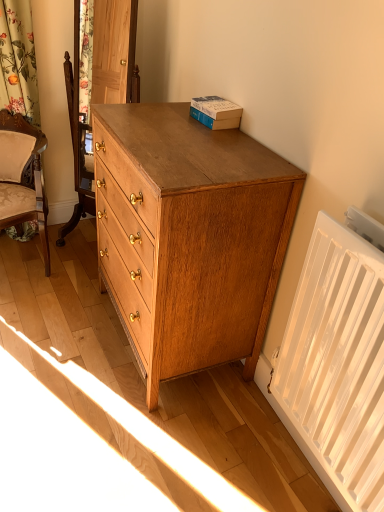
Find the location of a particular element. The height and width of the screenshot is (512, 384). vacant space situated above matte oak chest of drawers at right (from a real-world perspective) is located at coordinates (180, 134).